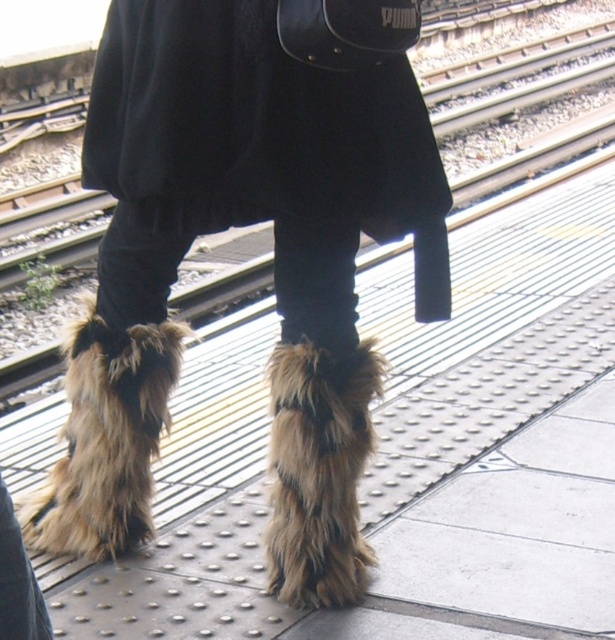
Question: Among these points, which one is farthest from the camera?

Choices:
 (A) (33, 531)
 (B) (304, 547)
 (C) (333, 300)

Answer: (A)

Question: Is the position of fuzzy fur boots at center less distant than that of fuzzy fur leg warmers at center?

Choices:
 (A) no
 (B) yes

Answer: (B)

Question: Can you confirm if fuzzy fur boots at center is positioned to the left of fuzzy fur leg warmer at lower center?

Choices:
 (A) no
 (B) yes

Answer: (B)

Question: Is fuzzy fur boots at center to the left of fuzzy fur leg warmers at center from the viewer's perspective?

Choices:
 (A) yes
 (B) no

Answer: (B)

Question: Estimate the real-world distances between objects in this image. Which object is closer to the fuzzy fur leg warmer at lower center?

Choices:
 (A) fuzzy fur leg warmers at center
 (B) fuzzy fur boots at center

Answer: (B)

Question: Among these points, which one is farthest from the camera?

Choices:
 (A) (314, 497)
 (B) (132, 452)

Answer: (B)